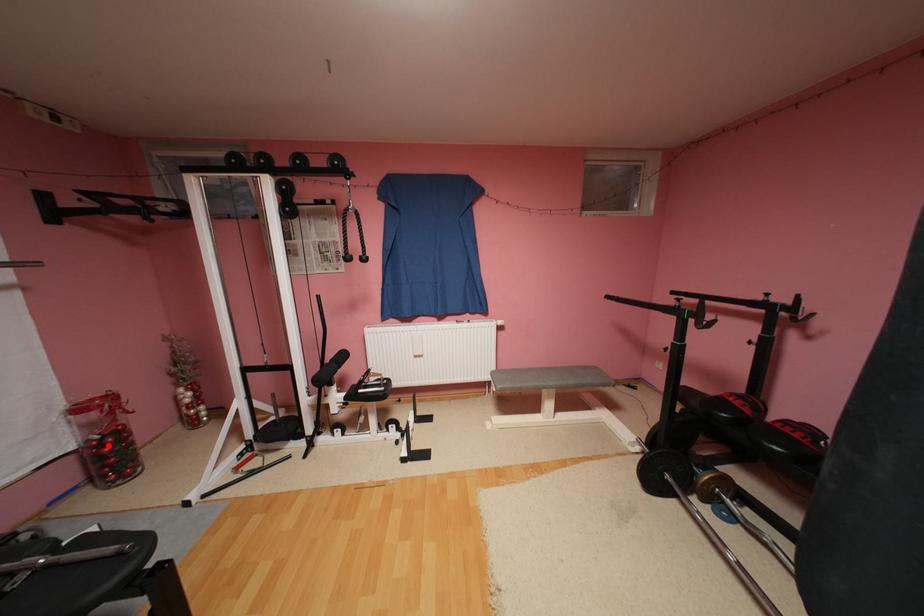
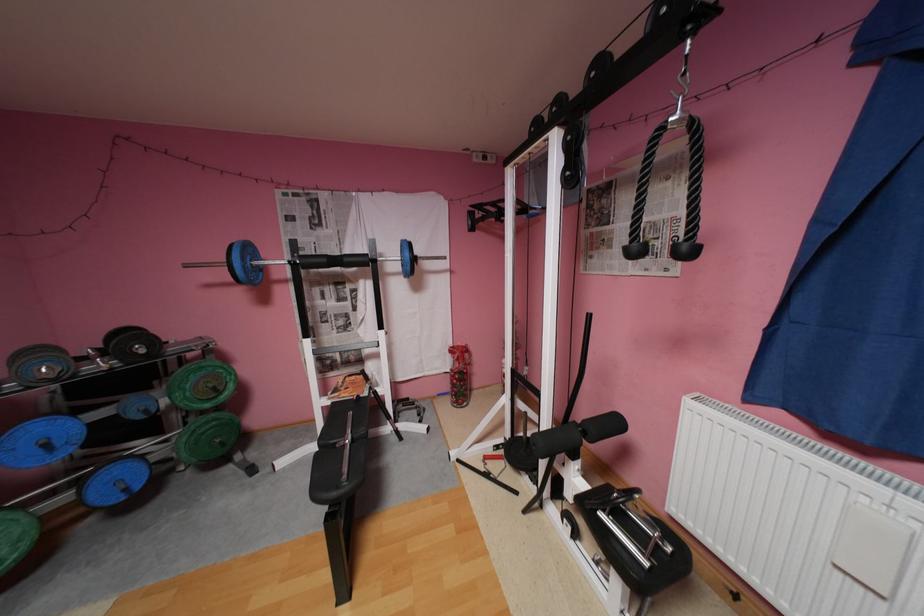
Find the pixel in the second image that matches the highlighted location in the first image.

(462, 377)